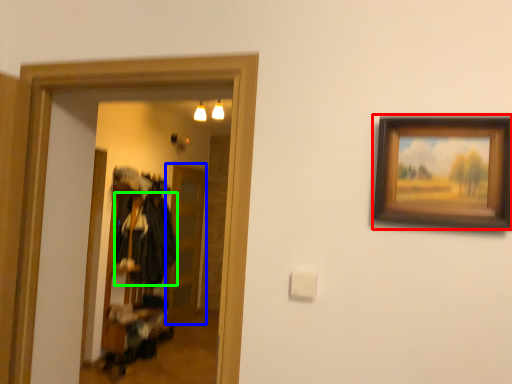
Question: Estimate the real-world distances between objects in this image. Which object is farther from picture frame (highlighted by a red box), glass door (highlighted by a blue box) or clothing (highlighted by a green box)?

Choices:
 (A) glass door
 (B) clothing

Answer: (A)